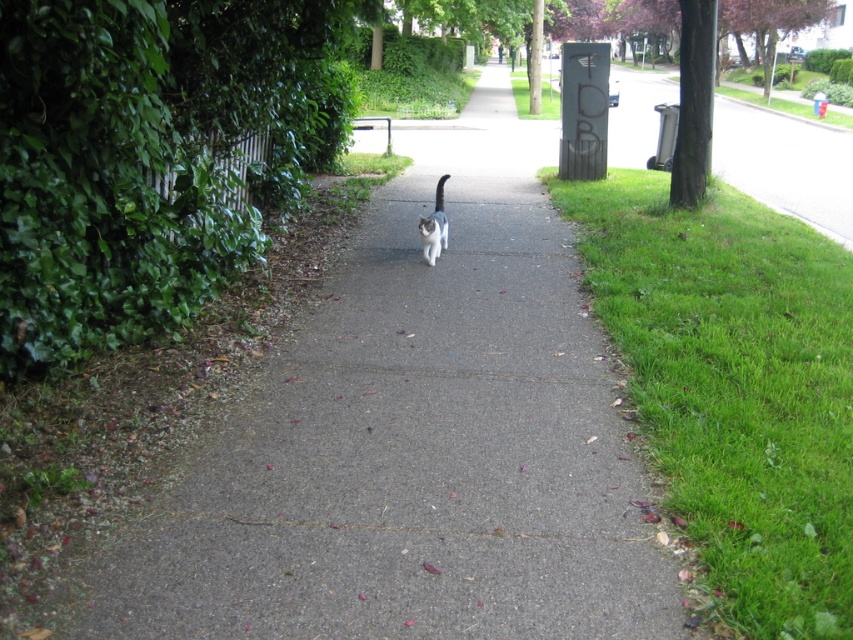
Question: Based on their relative distances, which object is farther from the white fur cat at center?

Choices:
 (A) green leafy hedge at left
 (B) green grass at lower right
 (C) gray asphalt pavement at center

Answer: (B)

Question: Where is gray asphalt pavement at center located in relation to green leafy hedge at left in the image?

Choices:
 (A) right
 (B) left

Answer: (A)

Question: Which of the following is the farthest from the observer?

Choices:
 (A) (428, 243)
 (B) (392, 204)
 (C) (233, 241)

Answer: (B)

Question: Based on their relative distances, which object is nearer to the gray asphalt pavement at center?

Choices:
 (A) white fur cat at center
 (B) green leafy hedge at left
 (C) green grass at lower right

Answer: (B)

Question: Is green grass at lower right to the right of white fur cat at center from the viewer's perspective?

Choices:
 (A) yes
 (B) no

Answer: (A)

Question: Can you confirm if gray asphalt pavement at center is positioned to the left of green leafy hedge at left?

Choices:
 (A) no
 (B) yes

Answer: (A)